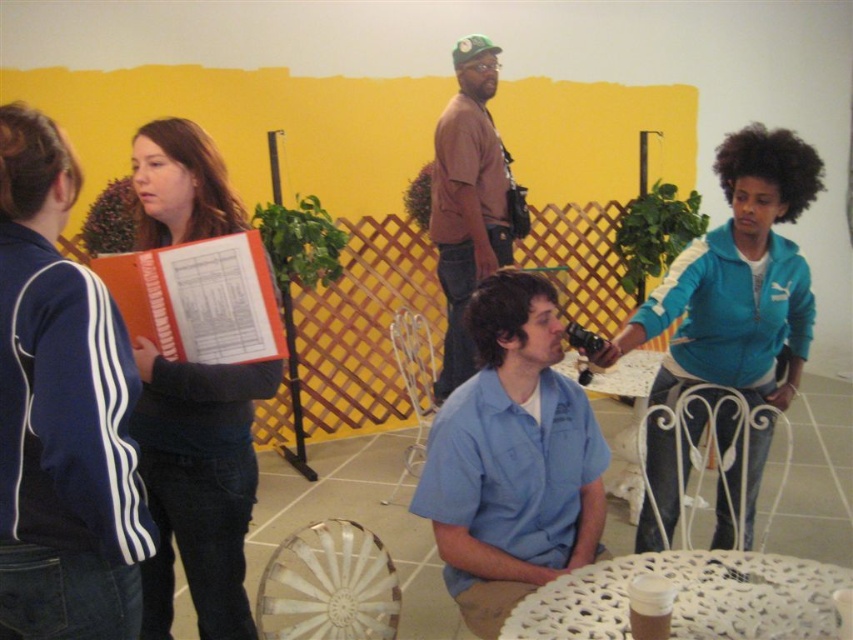
Consider the image. You are standing at the point labeled as point (239, 541) in the image. You want to move to the nearest exit, which is 2 meters away from your current position. Can you reach the exit without moving more than 2 meters?

The distance between point (239, 541) and the viewer is 1.87 meters. Since the exit is 2 meters away from your current position, you can reach the exit without moving more than 2 meters.

You are organizing a small event and need to arrange seating for guests. You have a white plastic chair at lower center and a metallic wire chair at center. Based on their positions, which chair is closer to the left side of the room?

The white plastic chair at lower center is positioned on the left side of the metallic wire chair at center, so it is closer to the left side of the room.

You are organizing a meeting and need to place a document from the matte orange folder at upper left onto the white wrought iron chair at lower right. Can you do this without moving the folder first?

The matte orange folder at upper left is in front of the white wrought iron chair at lower right, so you can place the document onto the chair without moving the folder first.